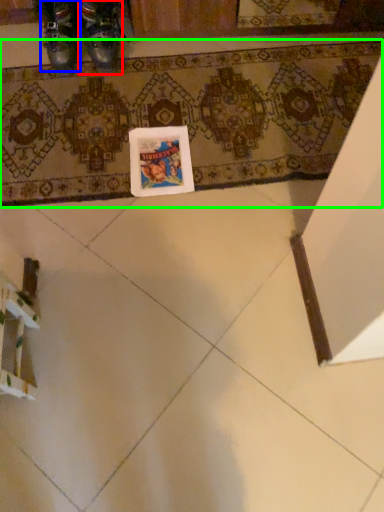
Question: Based on their relative distances, which object is nearer to footwear (highlighted by a red box)? Choose from footwear (highlighted by a blue box) and bath mat (highlighted by a green box).

Choices:
 (A) footwear
 (B) bath mat

Answer: (A)